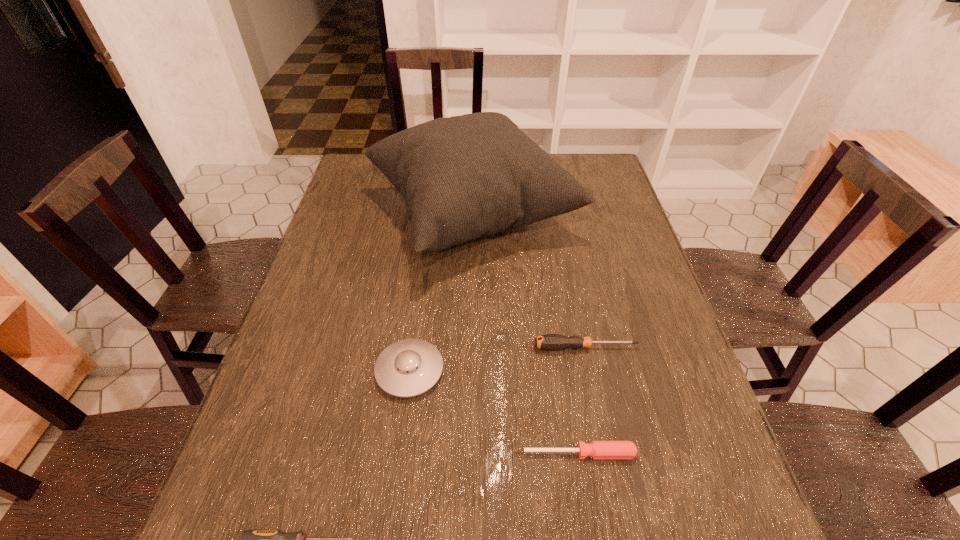
The image size is (960, 540). Identify the location of empty space that is in between the fourth shortest object and the second farthest screwdriver. (494, 412).

Identify the location of vacant region between the tallest object and the tallest screwdriver. (529, 281).

Locate an element on the screen. free spot between the saucer and the second nearest screwdriver is located at coordinates (494, 412).

This screenshot has height=540, width=960. Identify the location of empty location between the second farthest screwdriver and the farthest object. (525, 334).

What are the coordinates of `vacant space that is in between the tallest object and the saucer` in the screenshot? It's located at (441, 293).

Find the location of a particular element. The image size is (960, 540). free space between the saucer and the tallest object is located at coordinates (441, 293).

Locate an element on the screen. This screenshot has width=960, height=540. unoccupied area between the tallest object and the second farthest screwdriver is located at coordinates (525, 334).

Find the location of a particular element. This screenshot has height=540, width=960. free spot between the cushion and the fourth farthest object is located at coordinates (525, 334).

Point out which object is positioned as the second nearest to the leftmost screwdriver. Please provide its 2D coordinates. Your answer should be formatted as a tuple, i.e. [(x, y)], where the tuple contains the x and y coordinates of a point satisfying the conditions above.

[(596, 449)]

Identify which object is located as the fourth nearest to the farthest screwdriver. Please provide its 2D coordinates. Your answer should be formatted as a tuple, i.e. [(x, y)], where the tuple contains the x and y coordinates of a point satisfying the conditions above.

[(250, 539)]